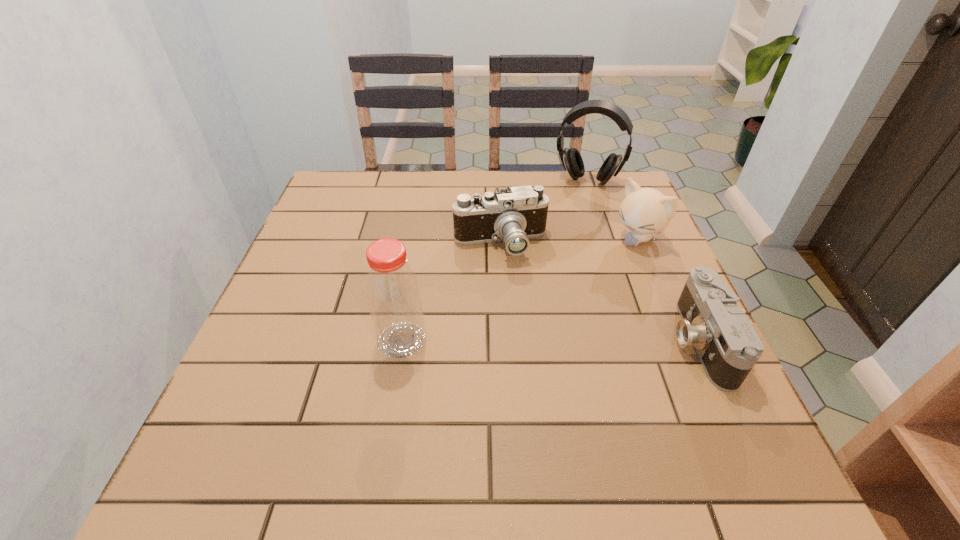
In order to click on vacant space at the far left corner in this screenshot , I will do `click(313, 215)`.

The height and width of the screenshot is (540, 960). I want to click on free location at the far right corner of the desktop, so click(595, 195).

Locate an element on the screen. vacant space at the near right corner of the desktop is located at coordinates (729, 414).

The width and height of the screenshot is (960, 540). What are the coordinates of `vacant region between the earphone and the third shortest object` in the screenshot? It's located at (612, 210).

You are a GUI agent. You are given a task and a screenshot of the screen. Output one action in this format:
    pyautogui.click(x=<x>, y=<y>)
    Task: Click on the free spot between the right camera and the farthest object
    The width and height of the screenshot is (960, 540).
    Given the screenshot: What is the action you would take?
    pyautogui.click(x=643, y=261)

Identify the location of unoccupied area between the third shortest object and the right camera. (668, 290).

I want to click on free space between the third shortest object and the right camera, so click(668, 290).

Find the location of a particular element. Image resolution: width=960 pixels, height=540 pixels. free space between the third shortest object and the second object from left to right is located at coordinates (568, 241).

Identify the location of free area in between the right camera and the bottle. (551, 341).

The height and width of the screenshot is (540, 960). In order to click on unoccupied area between the earphone and the shortest object in this screenshot , I will do `click(643, 261)`.